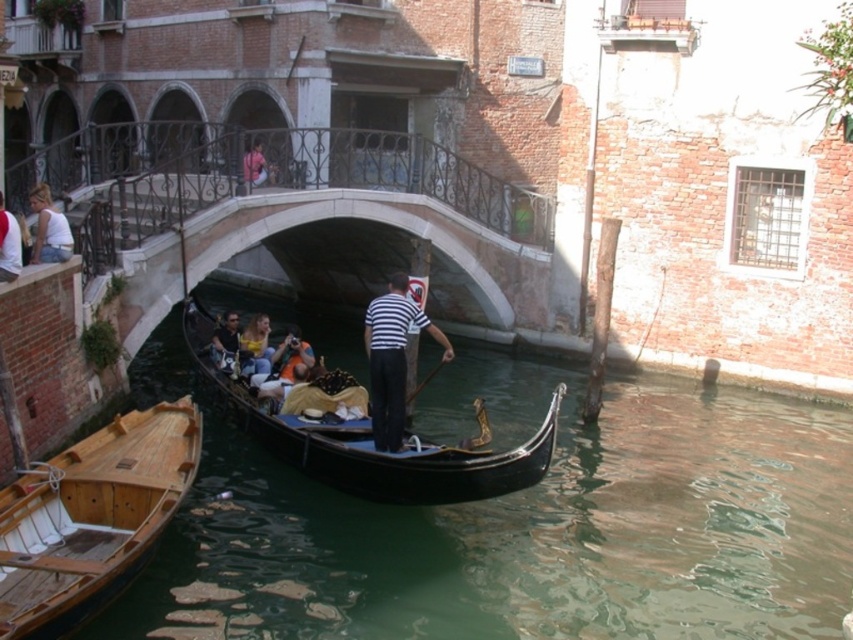
Based on the photo, you are a tour guide planning to take a group of tourists on a gondola ride. You need to ensure that the shiny black gondola at center can accommodate all passengers comfortably. Considering the white cotton shirt at left is worn by one of the tourists, can you determine if the gondola is wide enough to safely hold all passengers?

The shiny black gondola at center might be wider than white cotton shirt at left, so it is likely wide enough to safely hold all passengers.